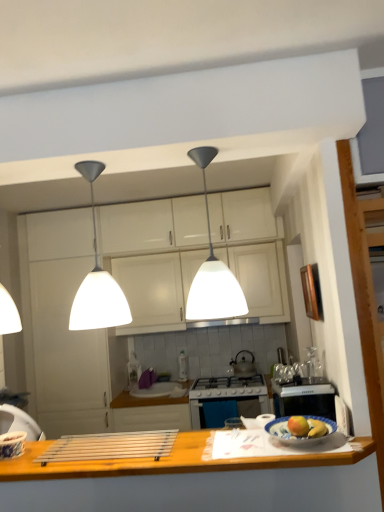
You are a GUI agent. You are given a task and a screenshot of the screen. Output one action in this format:
    pyautogui.click(x=<x>, y=<y>)
    Task: Click on the blank area to the left of matte yellow apple at center, which is the 2th apple in left-to-right order
    This screenshot has width=384, height=512.
    Given the screenshot: What is the action you would take?
    pyautogui.click(x=273, y=445)